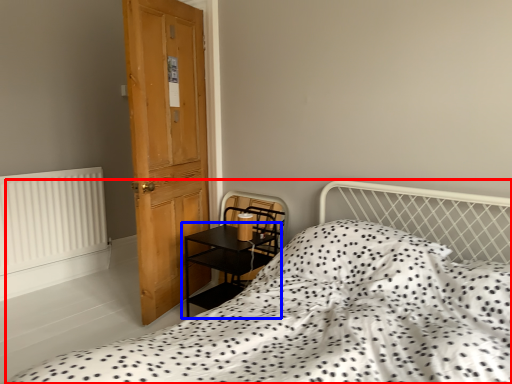
Question: Which object is further to the camera taking this photo, bed (highlighted by a red box) or table (highlighted by a blue box)?

Choices:
 (A) bed
 (B) table

Answer: (B)